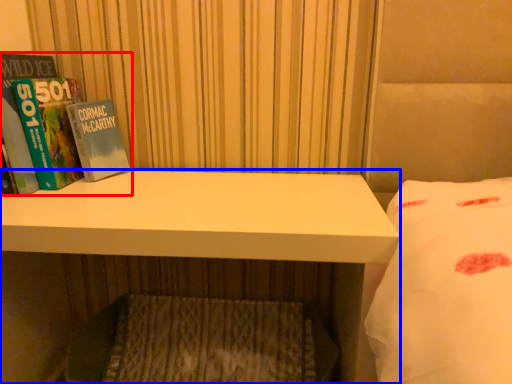
Question: Which point is further to the camera, book (highlighted by a red box) or desk (highlighted by a blue box)?

Choices:
 (A) book
 (B) desk

Answer: (A)